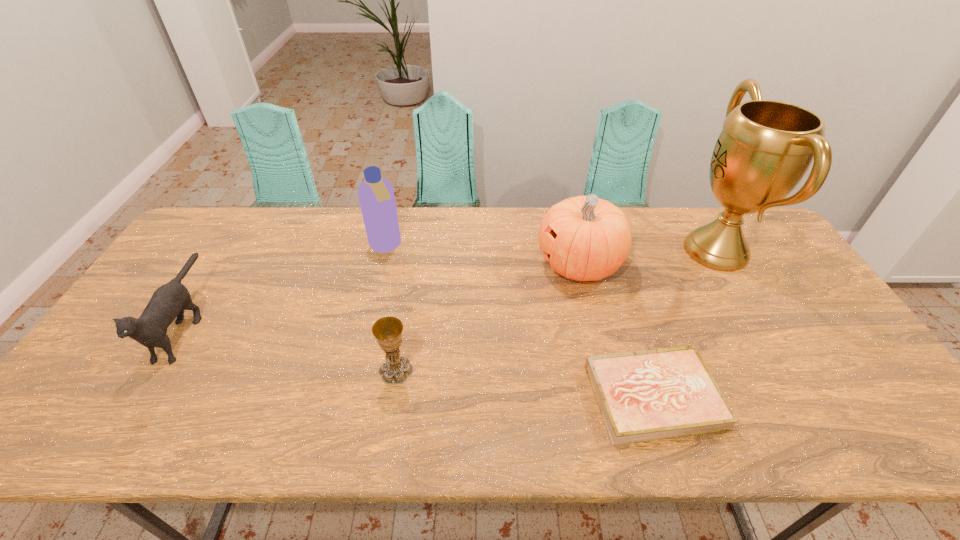
Locate an element on the screen. The height and width of the screenshot is (540, 960). the rightmost object is located at coordinates (765, 148).

You are a GUI agent. You are given a task and a screenshot of the screen. Output one action in this format:
    pyautogui.click(x=<x>, y=<y>)
    Task: Click on the tallest object
    This screenshot has height=540, width=960.
    Given the screenshot: What is the action you would take?
    pyautogui.click(x=765, y=148)

Where is `the second object from left to right`? Image resolution: width=960 pixels, height=540 pixels. the second object from left to right is located at coordinates (376, 196).

At what (x,y) coordinates should I click in order to perform the action: click on pumpkin. Please return your answer as a coordinate pair (x, y). The image size is (960, 540). Looking at the image, I should click on (584, 238).

Locate an element on the screen. cat is located at coordinates (169, 301).

Identify the location of the fourth object from right to left. (387, 330).

This screenshot has width=960, height=540. I want to click on hardback book, so click(x=647, y=395).

I want to click on blank area located 0.190m on the surface of the rightmost object with symbols, so click(x=620, y=251).

Find the location of a particular element. vacant region located 0.260m on the surface of the rightmost object with symbols is located at coordinates (598, 251).

The height and width of the screenshot is (540, 960). Identify the location of vacant space located on the surface of the rightmost object with symbols. (613, 251).